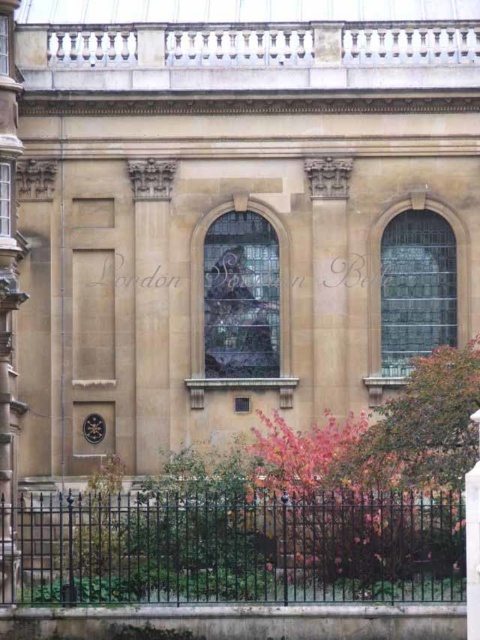
You are a visitor approaching the entrance of this classical building. You see the black wrought iron fence at lower center and the sandy stone column at center. Which object is closer to the left side of the entrance?

The black wrought iron fence at lower center is positioned on the left side of the sandy stone column at center, so it is closer to the left side of the entrance.

You are an architect examining the building facade. You notice the smooth stone pillar at left and the sandy stone column at center. Which one is closer to the viewer?

The smooth stone pillar at left is closer to the viewer because the sandy stone column at center is behind it.

From the picture: You are a visitor standing at the entrance of the classical building. You notice the black wrought iron fence at lower center and the smooth stone pillar at left. Which object is taller?

The smooth stone pillar at left is taller than the black wrought iron fence at lower center.